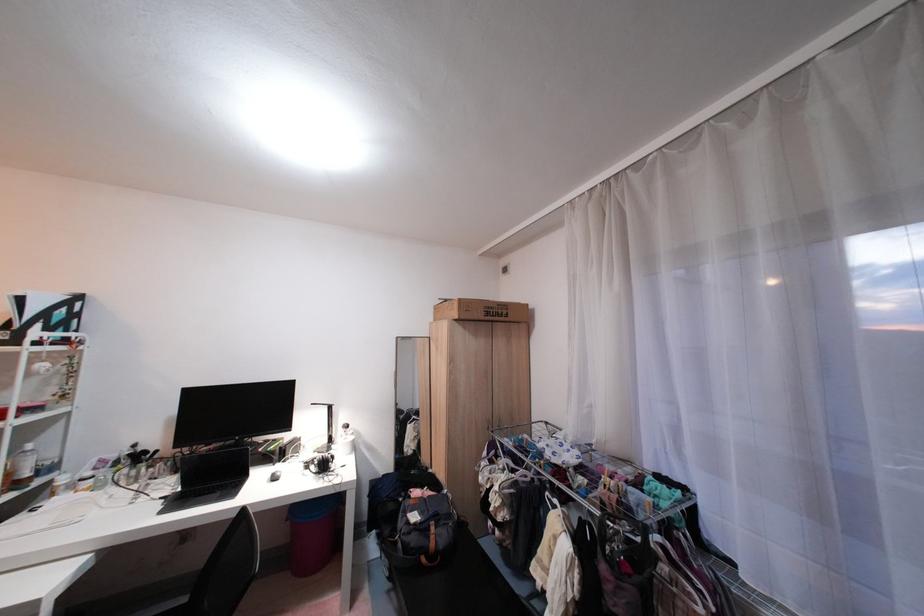
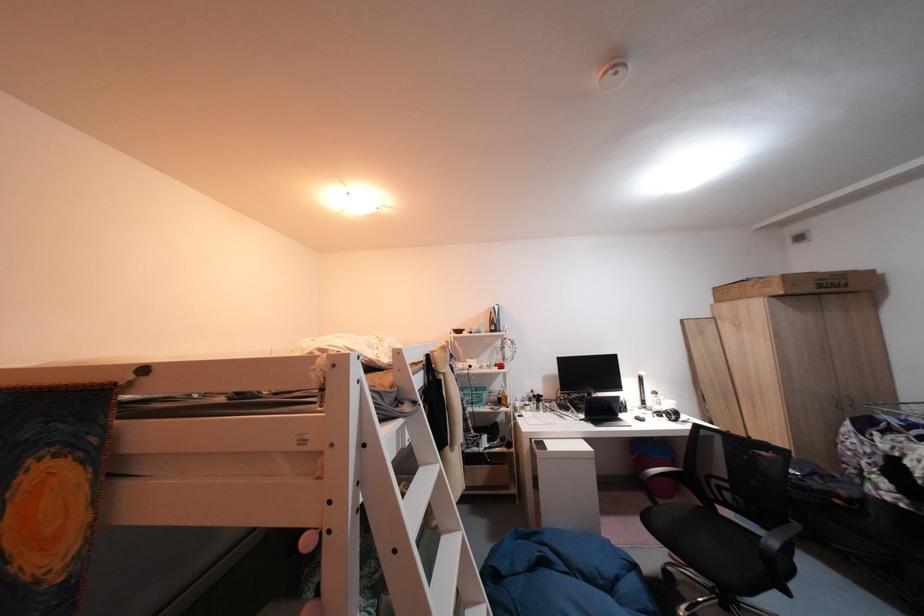
Locate, in the second image, the point that corresponds to the point at 470,302 in the first image.

(794, 278)